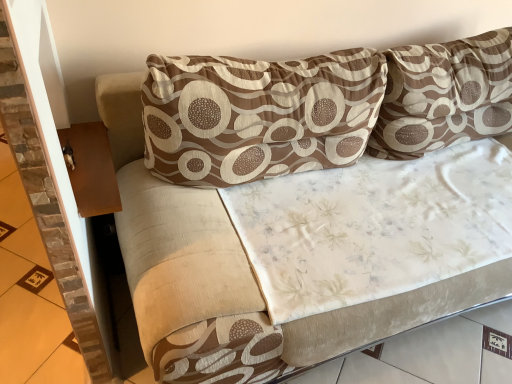
Question: Do you think brown stone tile at left is within brown textured pillow at center, positioned as the first pillow in left-to-right order, or outside of it?

Choices:
 (A) outside
 (B) inside

Answer: (A)

Question: In terms of size, does brown stone tile at left appear bigger or smaller than brown textured pillow at center, positioned as the first pillow in left-to-right order?

Choices:
 (A) small
 (B) big

Answer: (A)

Question: Which of these objects is positioned farthest from the brown stone tile at left?

Choices:
 (A) brown textured pillow at center, marked as the 2th pillow in a right-to-left arrangement
 (B) brown wood table at left
 (C) brown textured pillow at upper right, the first pillow when ordered from right to left

Answer: (C)

Question: Which of these objects is positioned farthest from the brown stone tile at left?

Choices:
 (A) brown textured pillow at center, positioned as the first pillow in left-to-right order
 (B) brown textured pillow at upper right, the first pillow when ordered from right to left
 (C) brown wood table at left

Answer: (B)